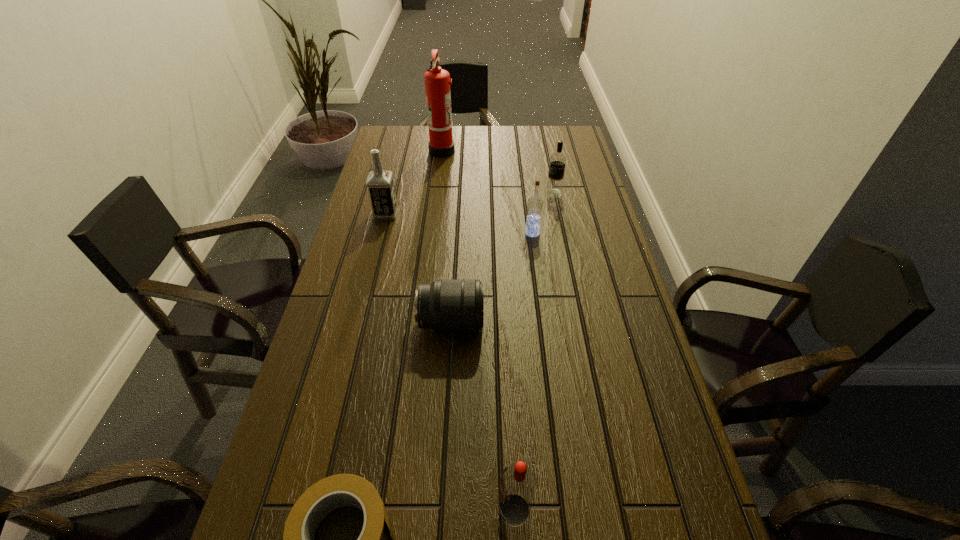
Where is `vacant space situated on the front label of the second vodka from left to right`? vacant space situated on the front label of the second vodka from left to right is located at coordinates (351, 510).

Identify the location of vacant space located on the surface of the third nearest object. (628, 323).

This screenshot has width=960, height=540. What are the coordinates of `object situated at the far edge` in the screenshot? It's located at (437, 81).

This screenshot has height=540, width=960. What are the coordinates of `object at the left edge` in the screenshot? It's located at (380, 185).

Where is `object present at the right edge`? Image resolution: width=960 pixels, height=540 pixels. object present at the right edge is located at coordinates (554, 188).

Locate an element on the screen. vacant space at the far edge of the desktop is located at coordinates (529, 143).

Where is `free space at the left edge of the desktop`? Image resolution: width=960 pixels, height=540 pixels. free space at the left edge of the desktop is located at coordinates (380, 307).

At what (x,y) coordinates should I click in order to perform the action: click on vacant space at the right edge of the desktop. Please return your answer as a coordinate pair (x, y). The image size is (960, 540). Looking at the image, I should click on (612, 368).

Locate an element on the screen. The image size is (960, 540). free space between the fourth nearest object and the farthest object is located at coordinates (487, 192).

Locate an element on the screen. The image size is (960, 540). unoccupied position between the farthest vodka and the sixth object from left to right is located at coordinates (542, 213).